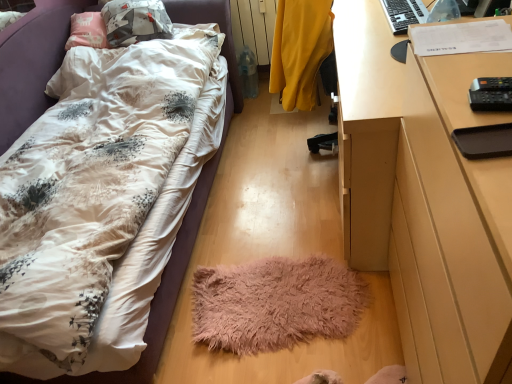
Question: From the image's perspective, is black matte tray at right under fluffy white bed at lower left?

Choices:
 (A) no
 (B) yes

Answer: (B)

Question: Considering the relative sizes of black matte tray at right and fluffy white bed at lower left in the image provided, is black matte tray at right bigger than fluffy white bed at lower left?

Choices:
 (A) no
 (B) yes

Answer: (A)

Question: Does black matte tray at right turn towards fluffy white bed at lower left?

Choices:
 (A) yes
 (B) no

Answer: (B)

Question: Is black matte tray at right taller than fluffy white bed at lower left?

Choices:
 (A) yes
 (B) no

Answer: (B)

Question: Is black matte tray at right positioned before fluffy white bed at lower left?

Choices:
 (A) yes
 (B) no

Answer: (A)

Question: Can you confirm if black matte tray at right is positioned to the left of fluffy white bed at lower left?

Choices:
 (A) yes
 (B) no

Answer: (B)

Question: Is black plastic keyboard at upper right completely or partially outside of black plastic remote control at right?

Choices:
 (A) yes
 (B) no

Answer: (A)

Question: Could you tell me if black plastic keyboard at upper right is facing black plastic remote control at right?

Choices:
 (A) no
 (B) yes

Answer: (A)

Question: Is black plastic keyboard at upper right to the right of black plastic remote control at right from the viewer's perspective?

Choices:
 (A) no
 (B) yes

Answer: (B)

Question: Would you say black plastic keyboard at upper right contains black plastic remote control at right?

Choices:
 (A) no
 (B) yes

Answer: (A)

Question: From the image's perspective, does black plastic keyboard at upper right appear lower than black plastic remote control at right?

Choices:
 (A) yes
 (B) no

Answer: (B)

Question: Does black plastic keyboard at upper right come behind black plastic remote control at right?

Choices:
 (A) yes
 (B) no

Answer: (A)

Question: Can we say fluffy white bed at lower left lies outside black plastic remote control at right?

Choices:
 (A) yes
 (B) no

Answer: (A)